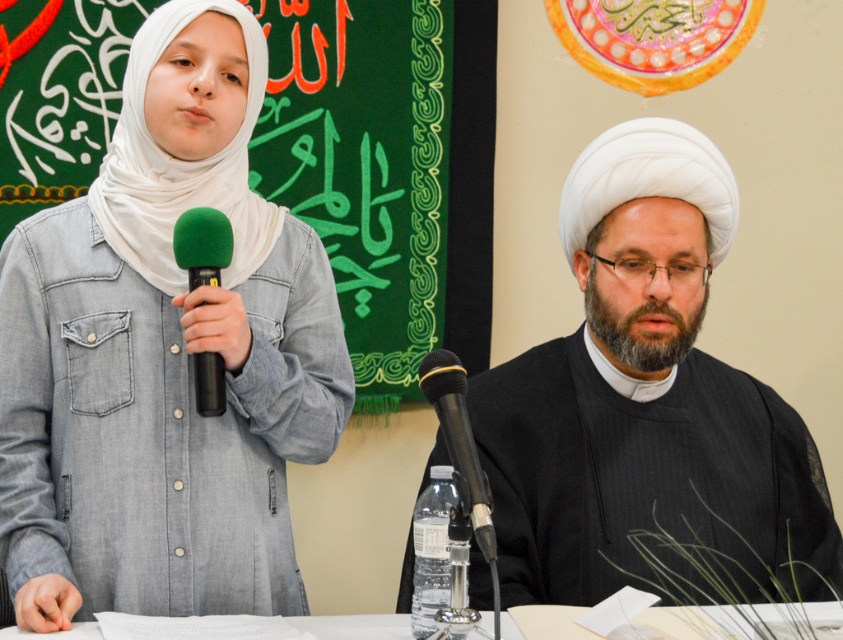
Which is behind, point (125, 228) or point (450, 458)?

Point (125, 228)

Is point (245, 198) in front of point (427, 372)?

No, (245, 198) is behind (427, 372).

In order to click on white matte headscarf at left in this screenshot , I will do `click(181, 163)`.

In the scene shown: Between green fabric poster at upper left and black matte microphone at center, which one appears on the left side from the viewer's perspective?

green fabric poster at upper left

Can you confirm if green fabric poster at upper left is positioned to the left of black matte microphone at center?

Indeed, green fabric poster at upper left is positioned on the left side of black matte microphone at center.

Locate an element on the screen. The width and height of the screenshot is (843, 640). green fabric poster at upper left is located at coordinates (364, 166).

Where is `green fabric poster at upper left`? green fabric poster at upper left is located at coordinates (364, 166).

Between green fabric poster at upper left and green matte microphone at left, which one has more height?

With more height is green fabric poster at upper left.

Which is more to the right, green fabric poster at upper left or green matte microphone at left?

From the viewer's perspective, green fabric poster at upper left appears more on the right side.

Between point (267, 84) and point (196, 253), which one is positioned in front?

Point (196, 253) is in front.

Where is `green fabric poster at upper left`? green fabric poster at upper left is located at coordinates (364, 166).